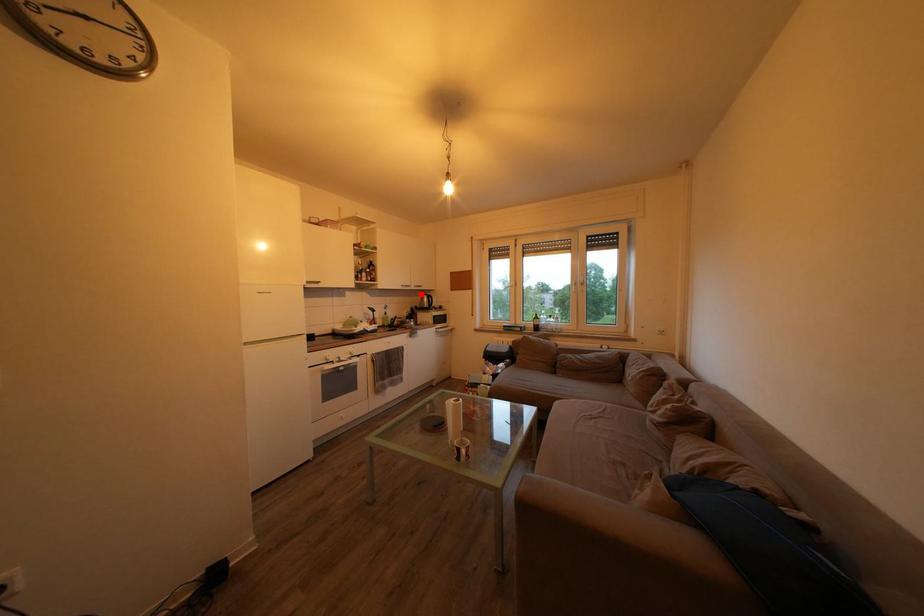
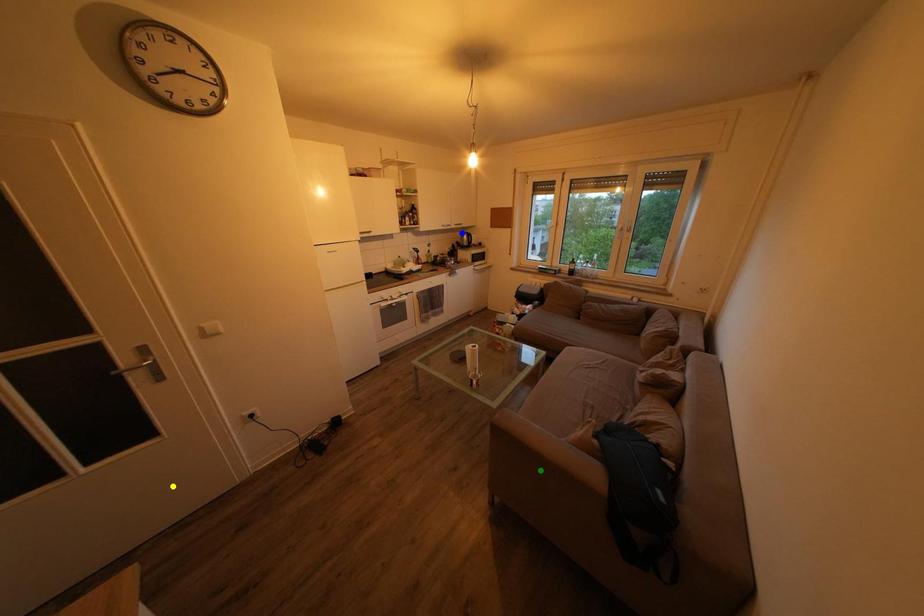
Question: I am providing you with two images of the same scene from different viewpoints. A red point is marked on the first image. You are given multiple points on the second image. Which spot in image 2 lines up with the point in image 1?

Choices:
 (A) blue point
 (B) yellow point
 (C) green point

Answer: (A)